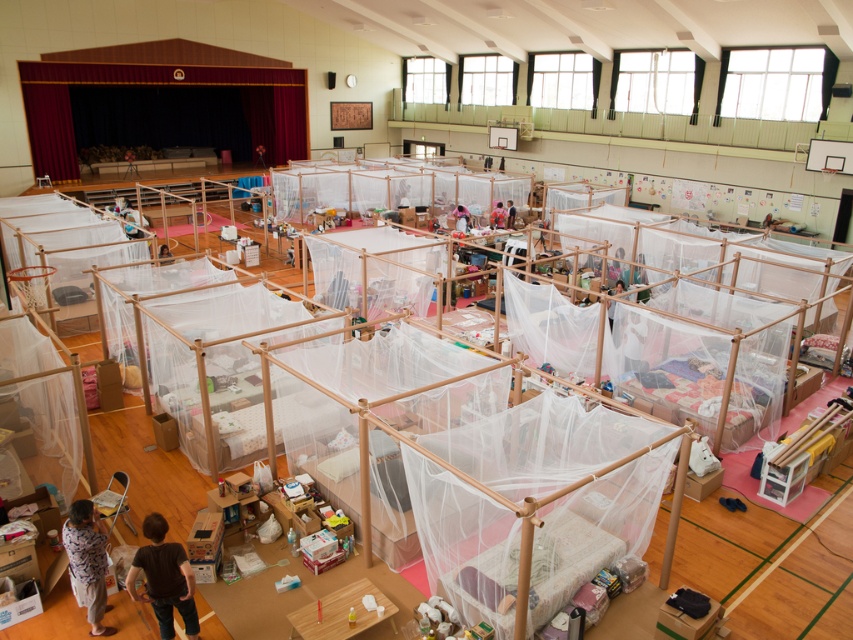
You are standing at the entrance of the gymnasium and need to locate the brown fabric child at lower left. According to the coordinates provided, where should you look relative to your position?

The brown fabric child at lower left is located at point coordinates 0.905 on the x axis and 0.193 on the y axis, so you should look to the lower left direction from your current position at the entrance.

You are a volunteer organizing items in the gymnasium. You see a brown fabric child at lower left and a light blue fabric shirt at lower left. If you need to place them together in a storage box that is 30 inches wide, will they fit side by side?

The brown fabric child at lower left and light blue fabric shirt at lower left are 32.77 inches apart, so they will not fit side by side in a 30 inch wide storage box since the required space exceeds the box width.